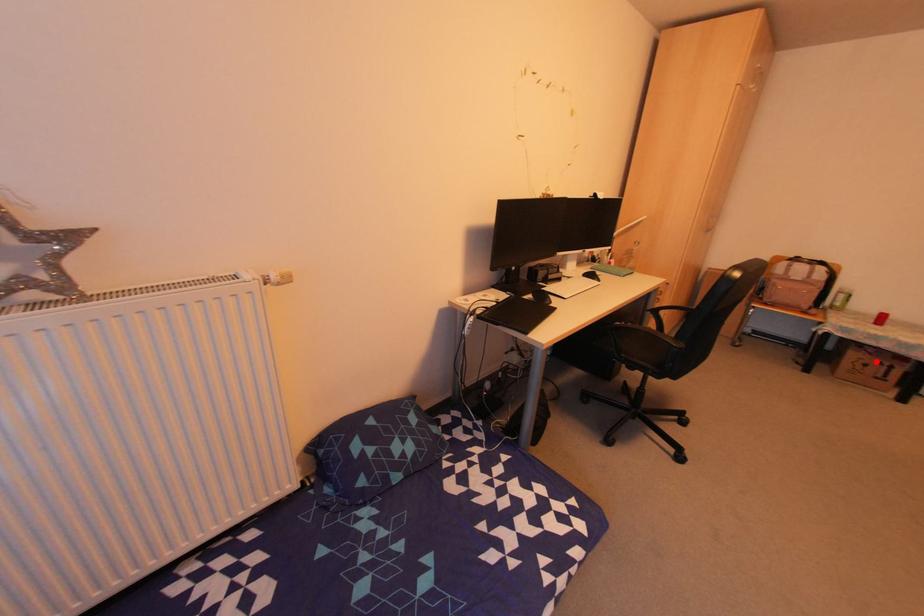
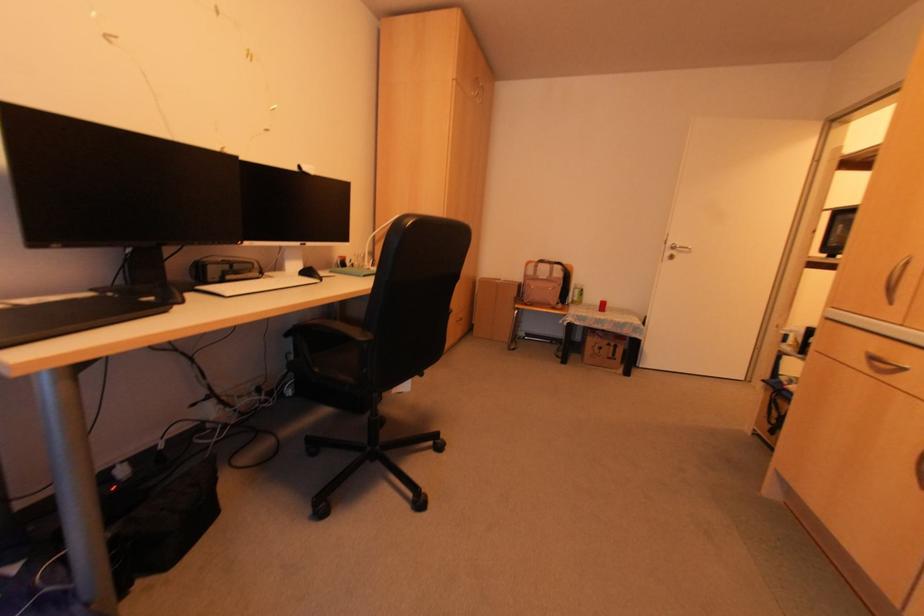
Locate, in the second image, the point that corresponds to the highlighted location in the first image.

(604, 342)